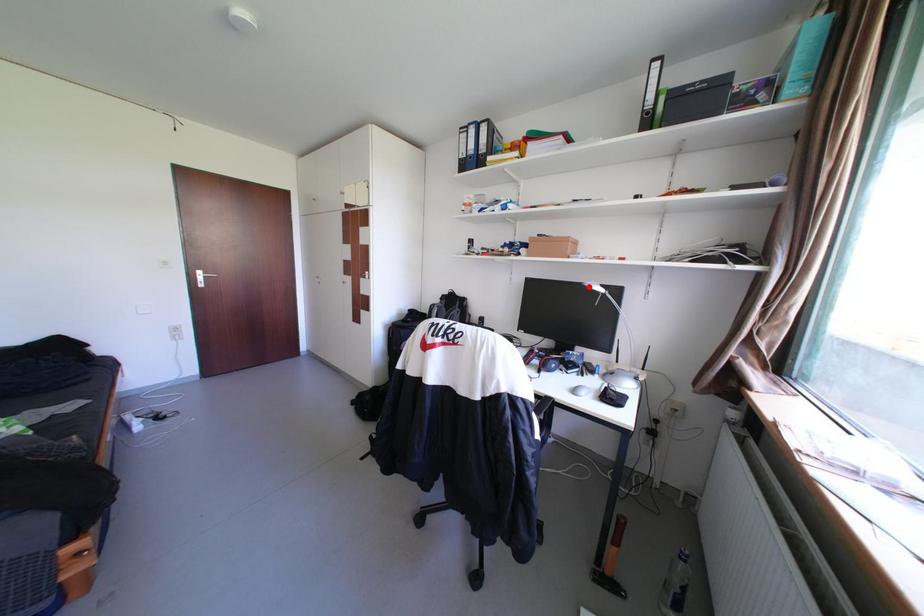
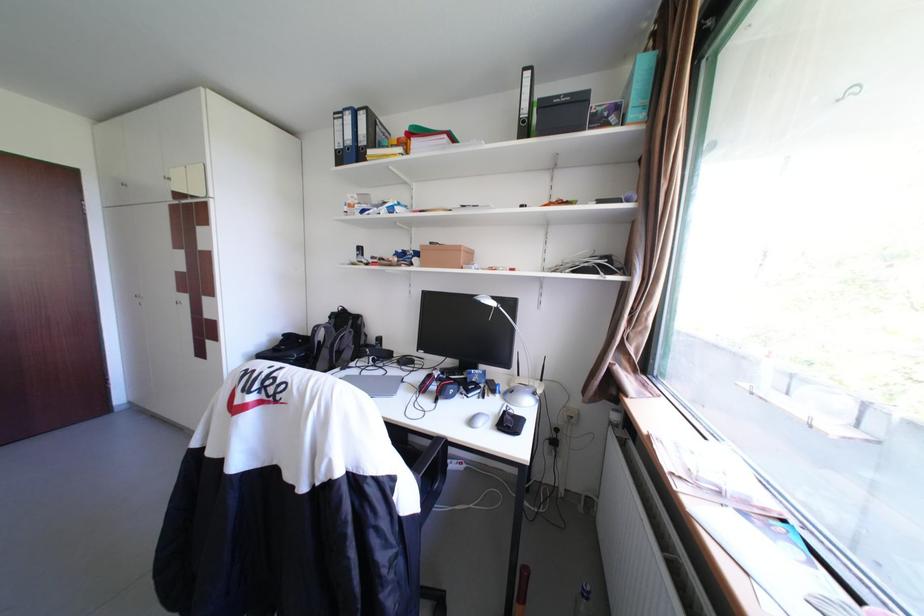
The point at the highlighted location is marked in the first image. Where is the corresponding point in the second image?

(480, 301)